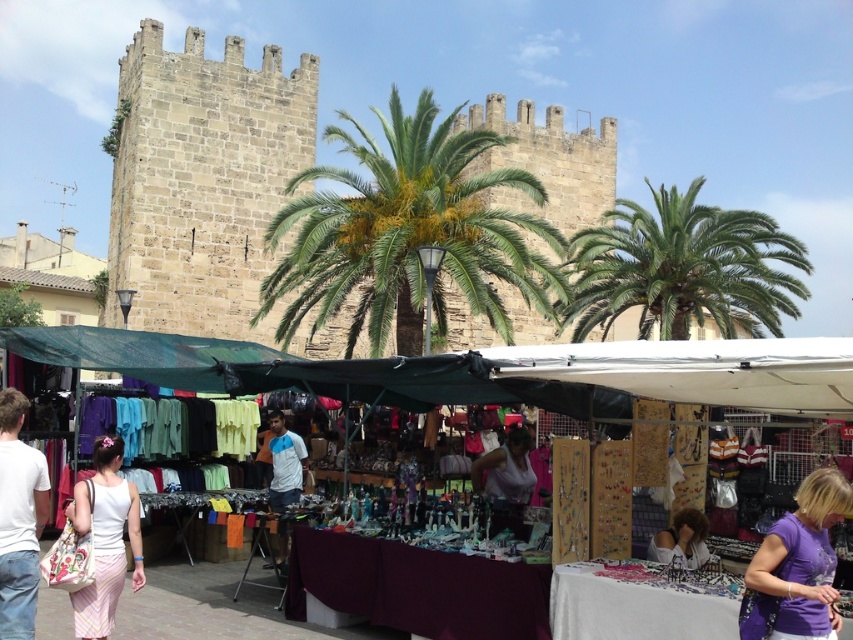
Question: Does green leafy palm tree at center appear on the left side of white fabric skirt at lower left?

Choices:
 (A) yes
 (B) no

Answer: (B)

Question: Which object appears farthest from the camera in this image?

Choices:
 (A) white fabric skirt at lower left
 (B) matte purple blouse at lower right

Answer: (B)

Question: Does white cotton shirt at lower left appear over matte purple blouse at lower right?

Choices:
 (A) no
 (B) yes

Answer: (B)

Question: Is matte fabric stall at center to the left of green leafy palm tree at upper center from the viewer's perspective?

Choices:
 (A) no
 (B) yes

Answer: (B)

Question: Considering the real-world distances, which object is closest to the white cotton shirt at lower left?

Choices:
 (A) matte purple blouse at lower right
 (B) matte fabric stall at center

Answer: (B)

Question: Among these points, which one is nearest to the camera?

Choices:
 (A) (691, 349)
 (B) (86, 516)
 (C) (491, 253)
 (D) (828, 589)

Answer: (D)